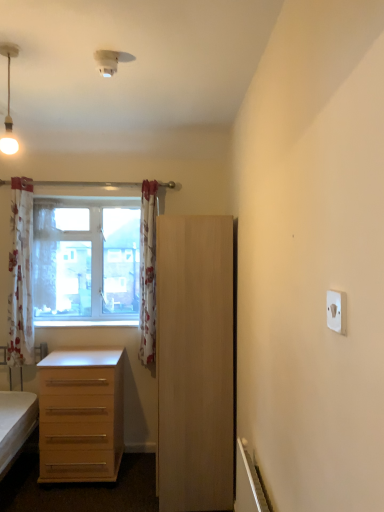
What are the coordinates of `vacant space in front of light wood drawer at lower left` in the screenshot? It's located at (70, 501).